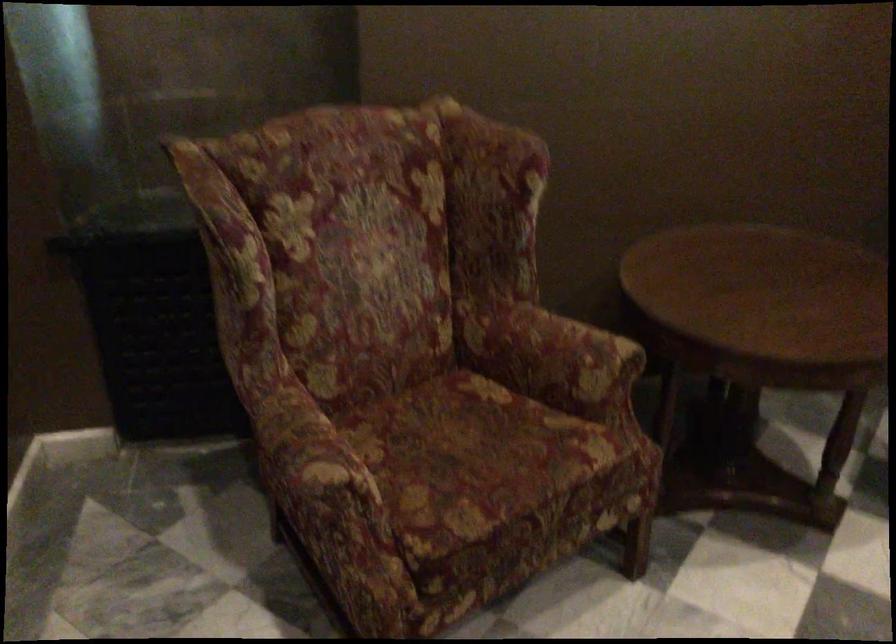
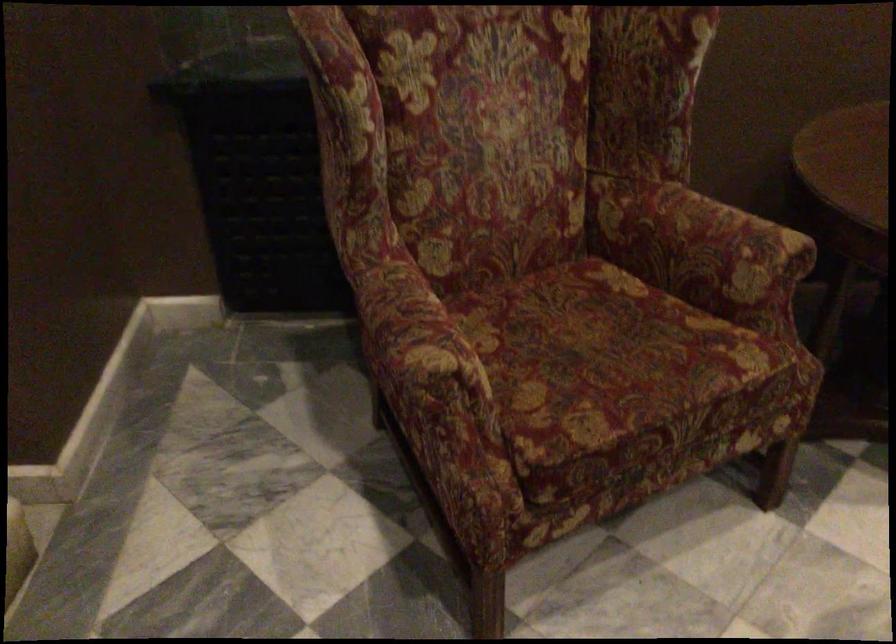
Where in the second image is the point corresponding to (324,488) from the first image?

(428, 377)